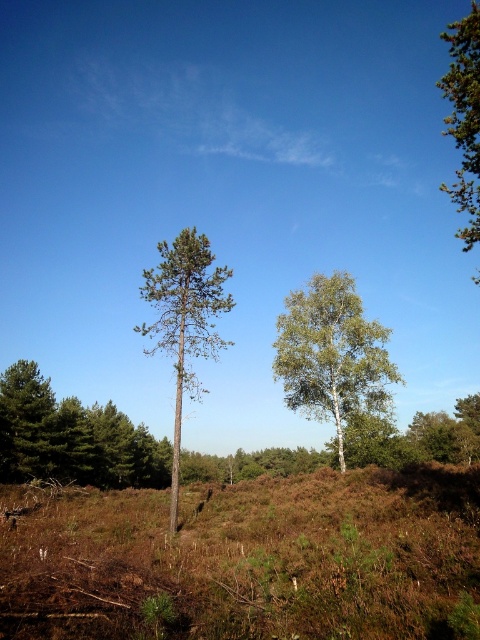
You are standing at the point marked as point (72, 436) in the image. What object is located exactly at this point?

The green matte tree at center is located exactly at point (72, 436).

You are standing at the point with coordinates point [248,560] in the image. Based on the scene description, what type of terrain are you currently standing on?

The point [248,560] corresponds to the brown grassy hillside at center, so you are standing on a brown grassy hillside.

You are planning to place a small garden statue exactly between the brown grassy hillside at center and the white smooth birch tree at center. Given their sizes, which object will the statue be closer to?

The statue will be closer to the white smooth birch tree at center because the brown grassy hillside at center is larger in size, meaning the birch tree is smaller and thus the statue placed between them would naturally be nearer to the smaller object.